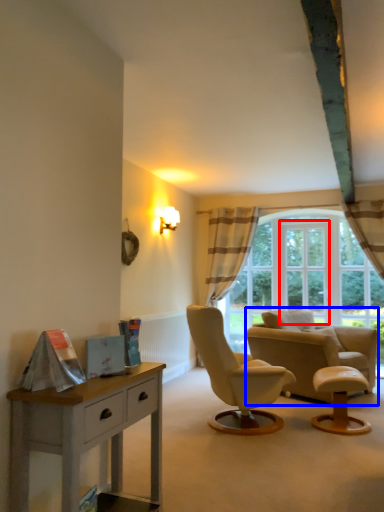
Question: Which object appears farthest to the camera in this image, window frame (highlighted by a red box) or chair (highlighted by a blue box)?

Choices:
 (A) window frame
 (B) chair

Answer: (A)